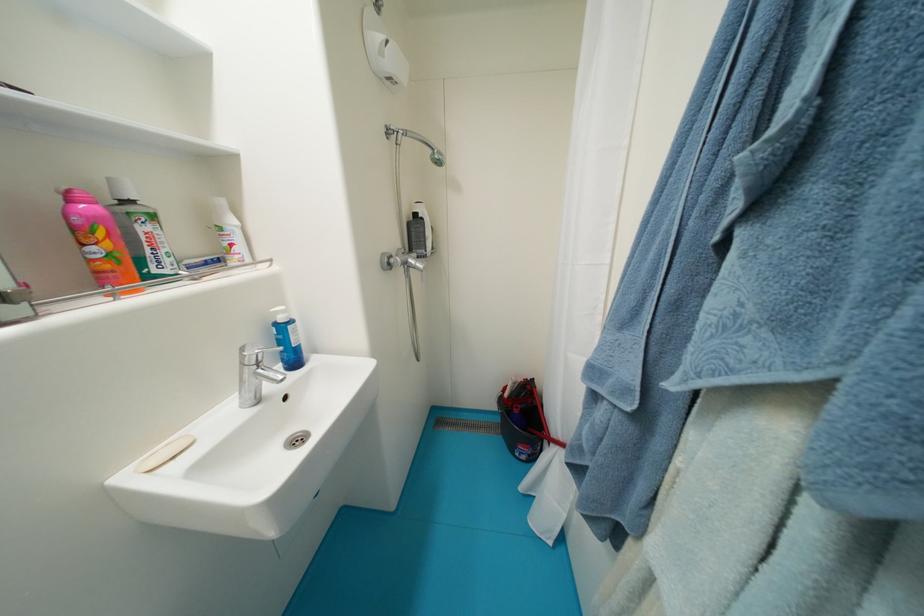
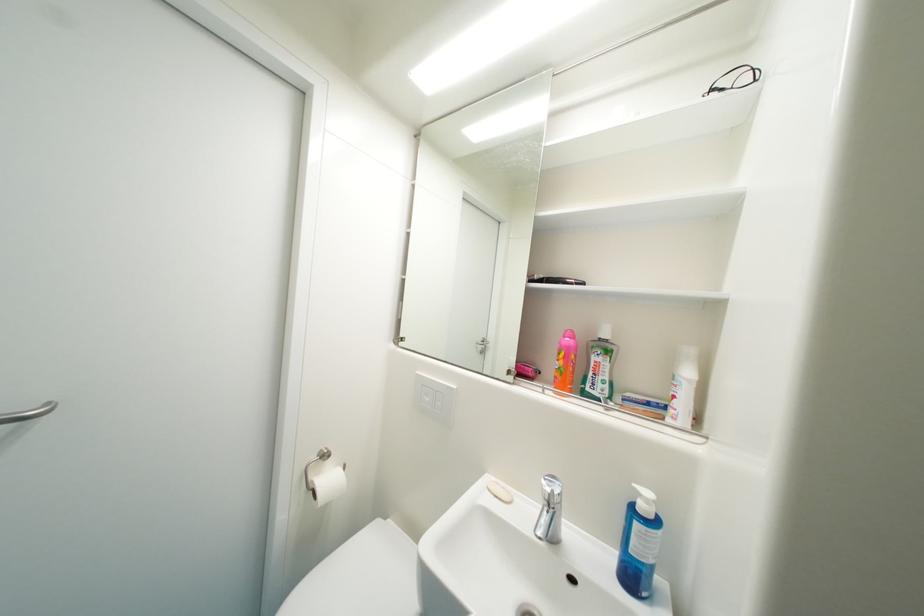
The point at (282, 326) is marked in the first image. Where is the corresponding point in the second image?

(641, 507)